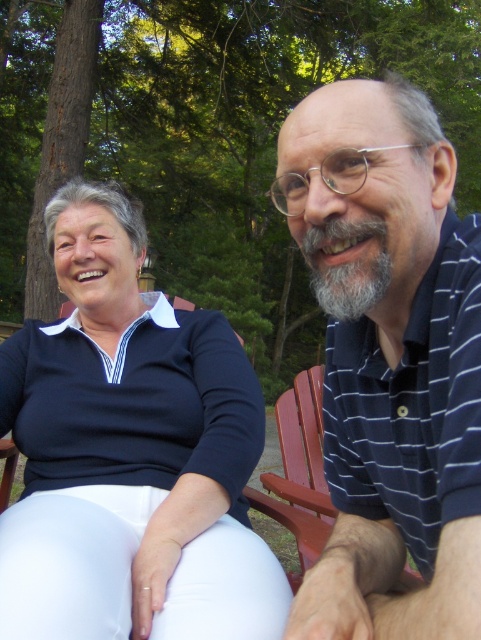
Question: Among these points, which one is farthest from the camera?

Choices:
 (A) (366, 324)
 (B) (169, 324)
 (C) (307, 518)

Answer: (B)

Question: Is matte black shirt at left in front of striped polo shirt at right?

Choices:
 (A) no
 (B) yes

Answer: (A)

Question: Which point is farther from the camera taking this photo?

Choices:
 (A) (302, 467)
 (B) (415, 250)
 (C) (95, 358)

Answer: (A)

Question: Which object is the farthest from the red wood chair at right?

Choices:
 (A) matte black shirt at left
 (B) striped polo shirt at right

Answer: (B)

Question: Can you confirm if matte black shirt at left is wider than red wood chair at right?

Choices:
 (A) yes
 (B) no

Answer: (A)

Question: Is matte black shirt at left positioned at the back of red wood chair at right?

Choices:
 (A) no
 (B) yes

Answer: (A)